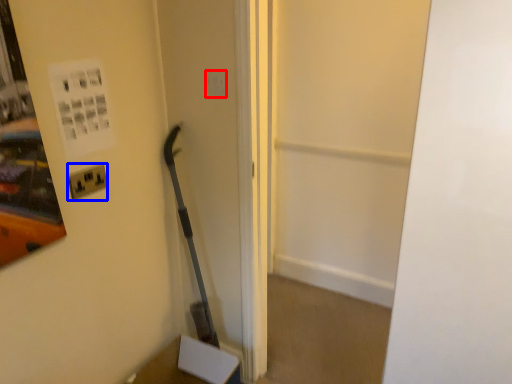
Question: Which object appears closest to the camera in this image, light switch (highlighted by a red box) or electric outlet (highlighted by a blue box)?

Choices:
 (A) light switch
 (B) electric outlet

Answer: (B)